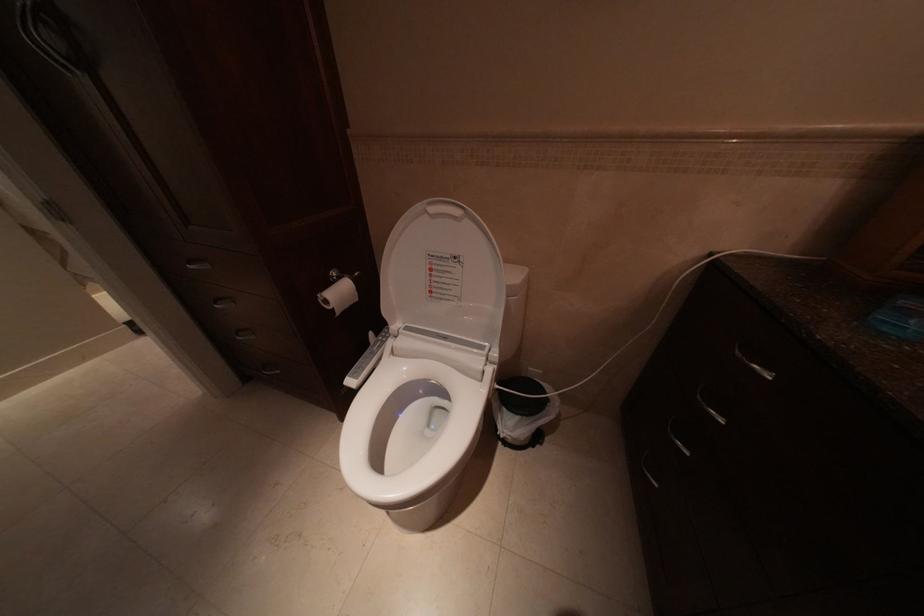
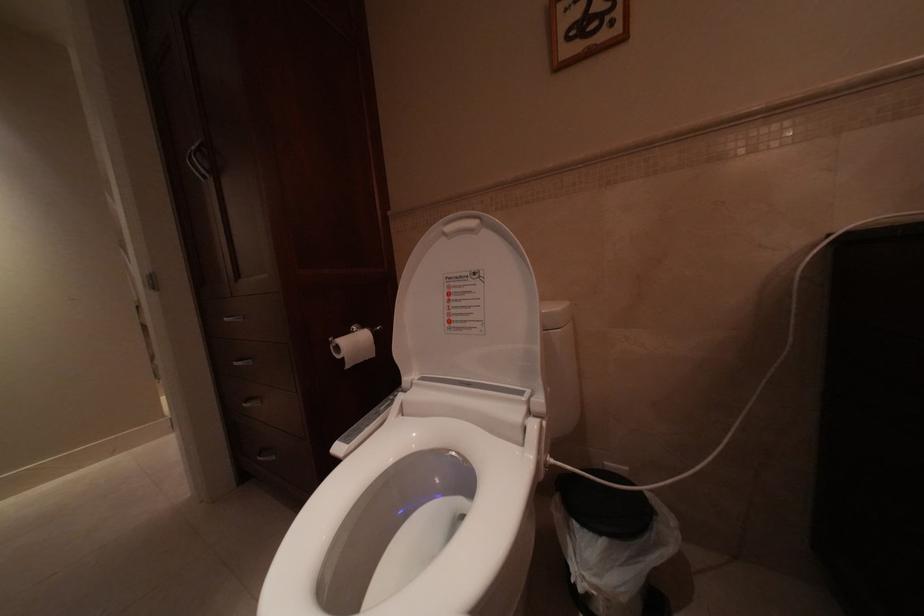
Question: The images are taken continuously from a first-person perspective. In which direction are you moving?

Choices:
 (A) Left
 (B) Right
 (C) Forward
 (D) Backward

Answer: (C)